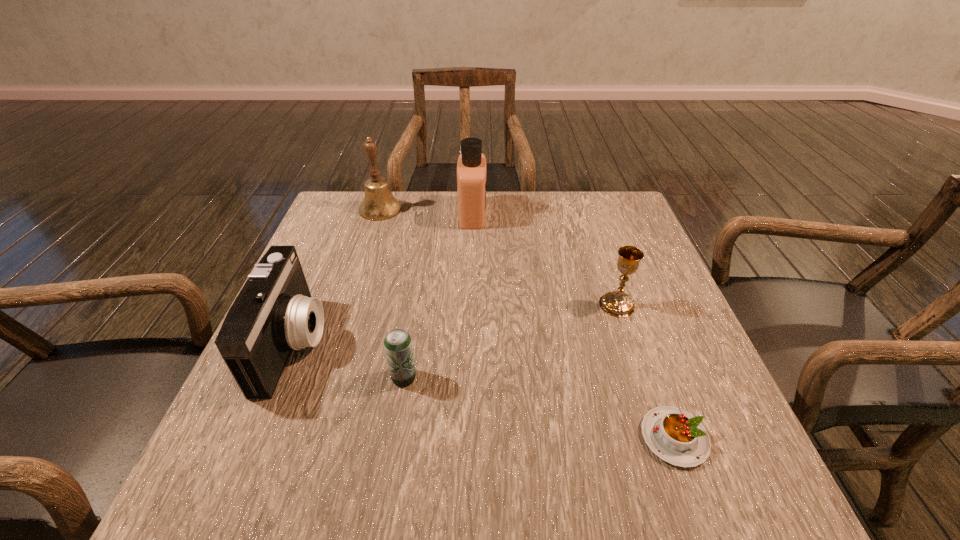
What are the coordinates of `bell` in the screenshot? It's located at (379, 204).

The width and height of the screenshot is (960, 540). Find the location of `the fourth object from left to right`. the fourth object from left to right is located at coordinates (471, 167).

Image resolution: width=960 pixels, height=540 pixels. Identify the location of camcorder. (274, 312).

You are a GUI agent. You are given a task and a screenshot of the screen. Output one action in this format:
    pyautogui.click(x=<x>, y=<y>)
    Task: Click on the chalice
    
    Given the screenshot: What is the action you would take?
    pyautogui.click(x=617, y=303)

Image resolution: width=960 pixels, height=540 pixels. Identify the location of beer can. (398, 346).

Locate an element on the screen. the fifth tallest object is located at coordinates (398, 346).

Identify the location of the shortest object. (675, 436).

Identify the location of pudding. (675, 436).

The height and width of the screenshot is (540, 960). Find the location of `free space located 0.270m on the front of the bell`. free space located 0.270m on the front of the bell is located at coordinates (356, 286).

The image size is (960, 540). What are the coordinates of `vacant space located on the front label of the perfume` in the screenshot? It's located at (507, 214).